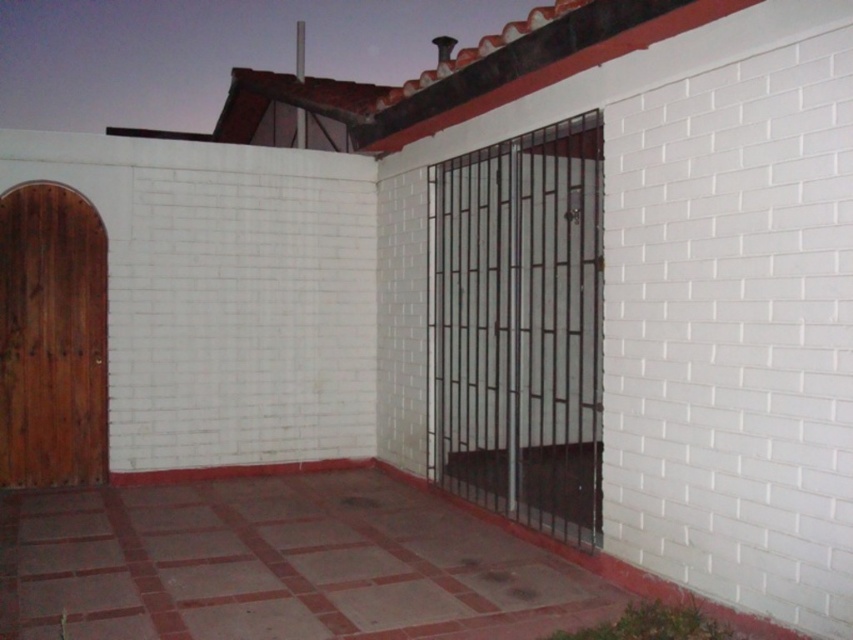
Question: Is metallic gate at center wider than wooden door at left?

Choices:
 (A) yes
 (B) no

Answer: (A)

Question: Which point is closer to the camera?

Choices:
 (A) (9, 422)
 (B) (532, 332)

Answer: (A)

Question: Which of the following is the closest to the observer?

Choices:
 (A) metallic gate at center
 (B) wooden door at left

Answer: (A)

Question: Is metallic gate at center thinner than wooden door at left?

Choices:
 (A) yes
 (B) no

Answer: (B)

Question: Which point is closer to the camera taking this photo?

Choices:
 (A) (566, 342)
 (B) (73, 371)

Answer: (B)

Question: Is metallic gate at center bigger than wooden door at left?

Choices:
 (A) no
 (B) yes

Answer: (B)